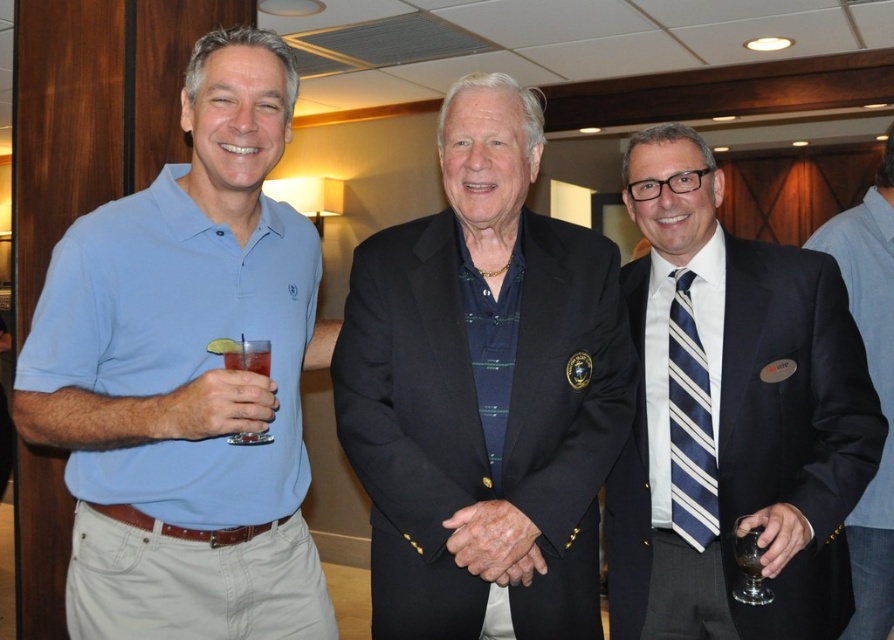
Between point (367, 244) and point (755, 572), which one is positioned behind?

Point (367, 244)

Does point (627, 420) come behind point (755, 605)?

That is False.

You are a GUI agent. You are given a task and a screenshot of the screen. Output one action in this format:
    pyautogui.click(x=<x>, y=<y>)
    Task: Click on the black textured blazer at center
    
    Given the screenshot: What is the action you would take?
    pyautogui.click(x=483, y=392)

What do you see at coordinates (184, 376) in the screenshot? This screenshot has height=640, width=894. I see `matte blue polo shirt at left` at bounding box center [184, 376].

Can you confirm if matte blue polo shirt at left is thinner than blue striped tie at center?

No.

Is point (44, 346) farther from camera compared to point (679, 276)?

No, it is not.

You are a GUI agent. You are given a task and a screenshot of the screen. Output one action in this format:
    pyautogui.click(x=<x>, y=<y>)
    Task: Click on the matte blue polo shirt at left
    
    Given the screenshot: What is the action you would take?
    pyautogui.click(x=184, y=376)

Is blue striped tie at center smaller than matte plastic cup at left?

No.

Between blue striped tie at center and matte plastic cup at left, which one has more height?

blue striped tie at center

Which is behind, point (692, 493) or point (263, 412)?

The point (692, 493) is more distant.

The height and width of the screenshot is (640, 894). In order to click on blue striped tie at center in this screenshot , I will do `click(689, 426)`.